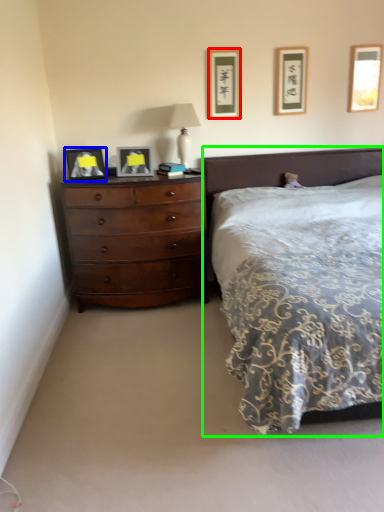
Question: Estimate the real-world distances between objects in this image. Which object is closer to picture frame (highlighted by a red box), picture frame (highlighted by a blue box) or bed (highlighted by a green box)?

Choices:
 (A) picture frame
 (B) bed

Answer: (B)